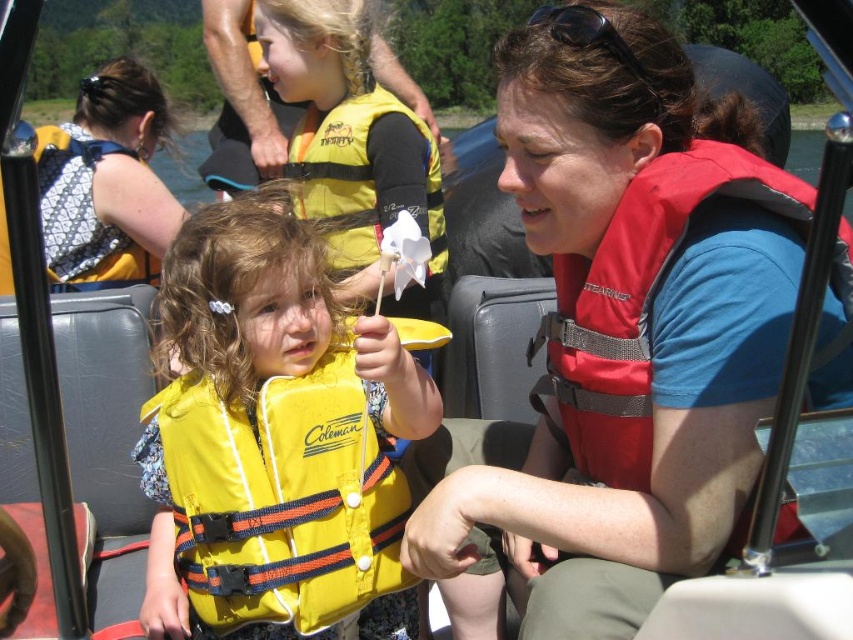
Question: Which point is farther from the camera taking this photo?

Choices:
 (A) (318, 182)
 (B) (271, 497)

Answer: (A)

Question: Does yellow fabric life vest at center have a smaller size compared to matte black backpack at upper left?

Choices:
 (A) no
 (B) yes

Answer: (B)

Question: Is red fabric life vest at right behind yellow life vest at center?

Choices:
 (A) no
 (B) yes

Answer: (A)

Question: Which point is farther to the camera?

Choices:
 (A) (195, 579)
 (B) (120, 284)
 (C) (564, 340)
 (D) (427, 157)

Answer: (B)

Question: Can you confirm if matte black backpack at upper left is bigger than yellow life vest at center?

Choices:
 (A) yes
 (B) no

Answer: (A)

Question: Among these points, which one is farthest from the camera?

Choices:
 (A) (54, 154)
 (B) (577, 300)
 (C) (341, 497)

Answer: (A)